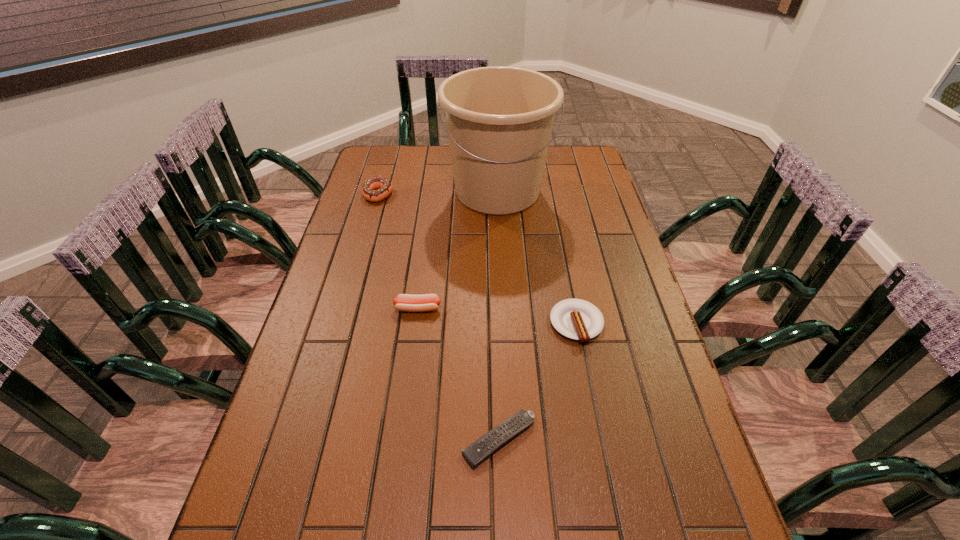
Locate an element on the screen. The image size is (960, 540). free location that satisfies the following two spatial constraints: 1. on the back side of the shortest object; 2. on the right side of the right sausage is located at coordinates (495, 323).

Locate an element on the screen. This screenshot has width=960, height=540. free spot that satisfies the following two spatial constraints: 1. on the back side of the left sausage; 2. on the left side of the bucket is located at coordinates (433, 191).

Image resolution: width=960 pixels, height=540 pixels. I want to click on free spot that satisfies the following two spatial constraints: 1. on the front side of the right sausage; 2. on the right side of the fourth shortest object, so click(341, 323).